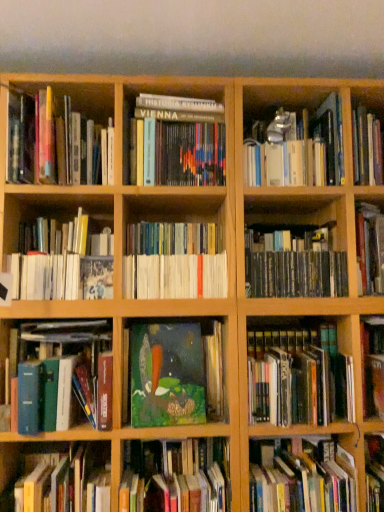
Question: Considering the positions of white paperbacks at center, placed as the 8th book when sorted from bottom to top, and hardcover book at upper right, the first book from the top, in the image, is white paperbacks at center, placed as the 8th book when sorted from bottom to top, bigger or smaller than hardcover book at upper right, the first book from the top,?

Choices:
 (A) big
 (B) small

Answer: (B)

Question: From a real-world perspective, is white paperbacks at center, placed as the 8th book when sorted from bottom to top, physically located above or below hardcover book at upper right, which is the twelfth book in bottom-to-top order?

Choices:
 (A) below
 (B) above

Answer: (A)

Question: Which object is the farthest from the hardcover book at upper right, the first book from the top?

Choices:
 (A) hardcover book at lower left, the second book ordered from the bottom
 (B) hardcover book at lower right, arranged as the twelfth book when viewed from the top
 (C) black matte cd case at center right, the 6th book positioned from the top
 (D) green matte painting at center, the 8th book from the top
 (E) green matte book at center, the 3th book when ordered from bottom to top

Answer: (A)

Question: Which is nearer to the hardcover book at center, which ranks as the 3th book in top-to-bottom order?

Choices:
 (A) hardcover book at lower right, arranged as the twelfth book when viewed from the top
 (B) green matte painting at center, the 8th book from the top
 (C) white paperbacks at center, arranged as the 5th book when viewed from the top
 (D) hardcover book at upper right, which is the twelfth book in bottom-to-top order
 (E) green matte book at center, the tenth book viewed from the top

Answer: (D)